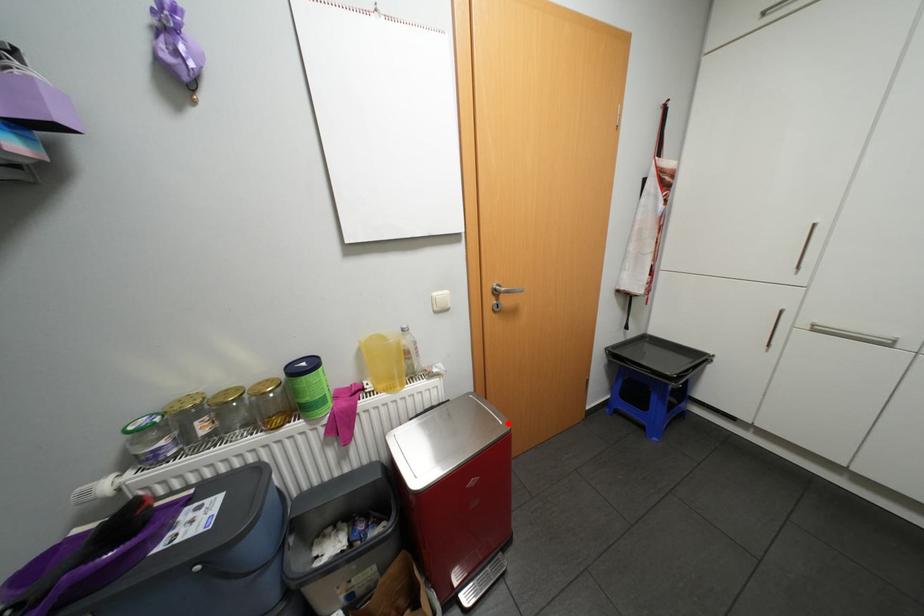
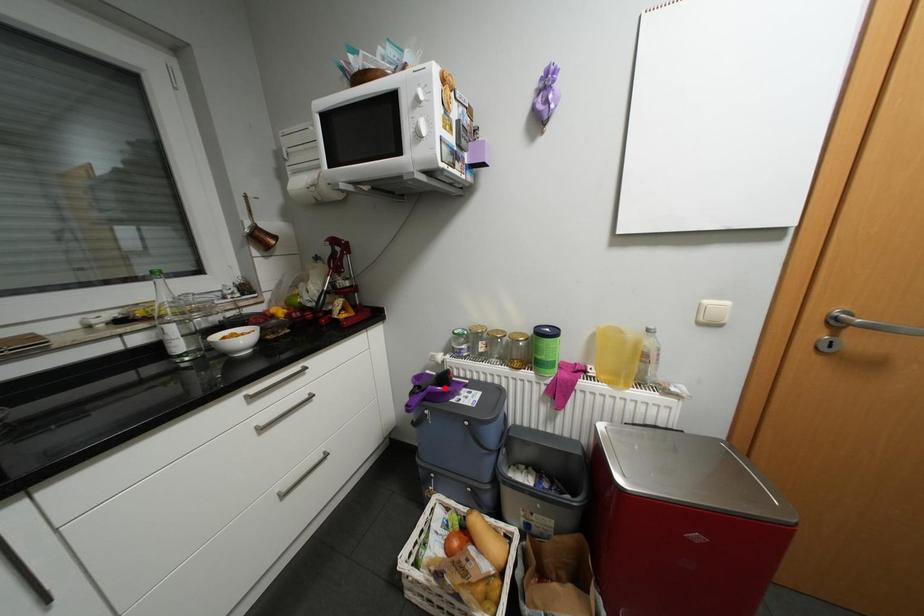
I am providing you with two images of the same scene from different viewpoints. A red point is marked on the first image and another point is marked on the second image. Do the highlighted points in image1 and image2 indicate the same real-world spot?

No